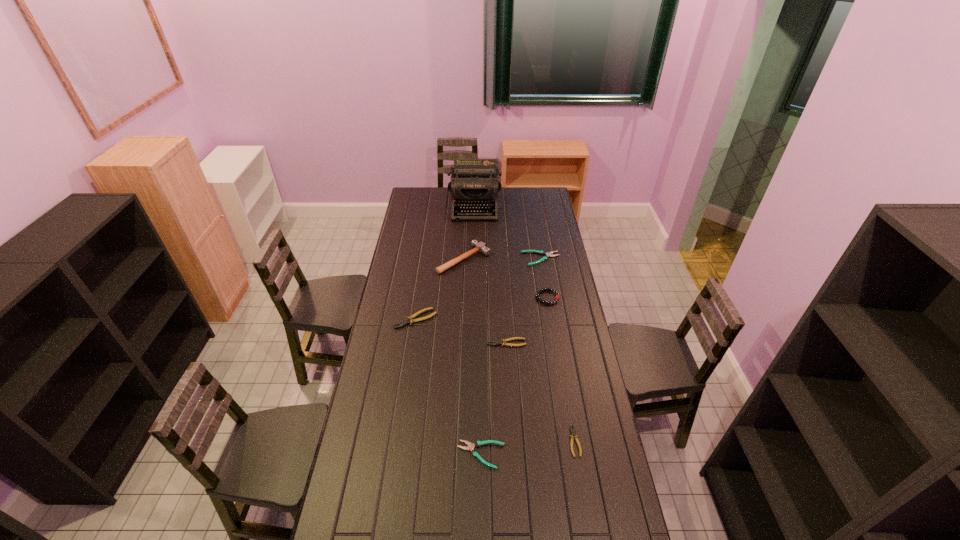
I want to click on the second farthest yellow pliers, so click(x=504, y=341).

Locate an element on the screen. This screenshot has height=540, width=960. the left teal pliers is located at coordinates (470, 446).

Identify the location of the nearer teal pliers. (470, 446).

You are a GUI agent. You are given a task and a screenshot of the screen. Output one action in this format:
    pyautogui.click(x=<x>, y=<y>)
    Task: Click on the rightmost yellow pliers
    This screenshot has height=540, width=960.
    Given the screenshot: What is the action you would take?
    pyautogui.click(x=573, y=435)

Where is `the smallest yellow pliers`? Image resolution: width=960 pixels, height=540 pixels. the smallest yellow pliers is located at coordinates point(573,435).

Where is `blank space located on the keyboard of the typewriter`? The image size is (960, 540). blank space located on the keyboard of the typewriter is located at coordinates (474, 255).

The height and width of the screenshot is (540, 960). In order to click on free space located on the front of the seventh shortest object in this screenshot , I will do `click(463, 292)`.

Where is `vacant position located on the back of the fifth nearest object`? vacant position located on the back of the fifth nearest object is located at coordinates (540, 247).

Image resolution: width=960 pixels, height=540 pixels. Find the location of `free space located 0.370m on the right of the farthest yellow pliers`. free space located 0.370m on the right of the farthest yellow pliers is located at coordinates (516, 319).

This screenshot has width=960, height=540. I want to click on free location located on the left of the bigger teal pliers, so click(491, 259).